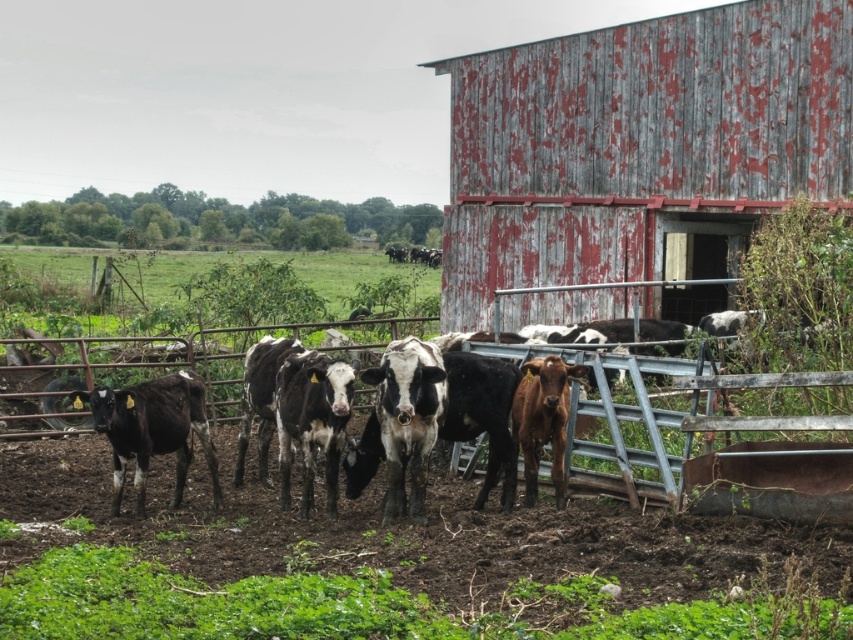
Does black glossy cow at left have a larger size compared to brown glossy calf at center?

Yes.

Who is positioned more to the left, black glossy cow at left or brown glossy calf at center?

Positioned to the left is black glossy cow at left.

Between point (216, 465) and point (556, 404), which one is positioned behind?

The point (216, 465) is more distant.

Where is `black glossy cow at left`? black glossy cow at left is located at coordinates (152, 429).

Is peeling gray wood barn at right to the left of black and white cow at center from the viewer's perspective?

No, peeling gray wood barn at right is not to the left of black and white cow at center.

Where is `peeling gray wood barn at right`? peeling gray wood barn at right is located at coordinates (640, 147).

Where is `peeling gray wood barn at right`? The height and width of the screenshot is (640, 853). peeling gray wood barn at right is located at coordinates (640, 147).

Does black and white cow at center have a smaller size compared to brown glossy calf at center?

No.

Where is `black and white cow at center`? Image resolution: width=853 pixels, height=640 pixels. black and white cow at center is located at coordinates (312, 420).